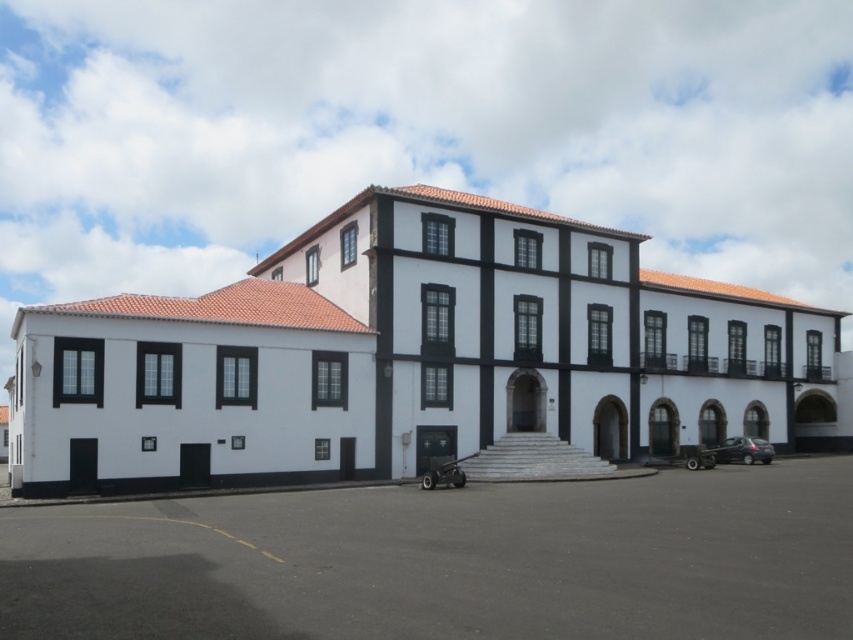
From the picture: You are an architect analyzing the symmetry of the building. The black matte trim at center is part of the building design. Based on its position coordinates, can you determine if it is placed symmetrically along the building facade?

The black matte trim at center is positioned at coordinates point (410, 356), which suggests it is placed symmetrically along the building facade since it is centered both horizontally and vertically.

You are a visitor approaching the building and see the black matte trim at center and the dark asphalt parking lot at center. Which object is located to the left when facing the building?

The black matte trim at center is positioned on the left side of dark asphalt parking lot at center, so when facing the building, the black matte trim at center is to the left of the dark asphalt parking lot at center.